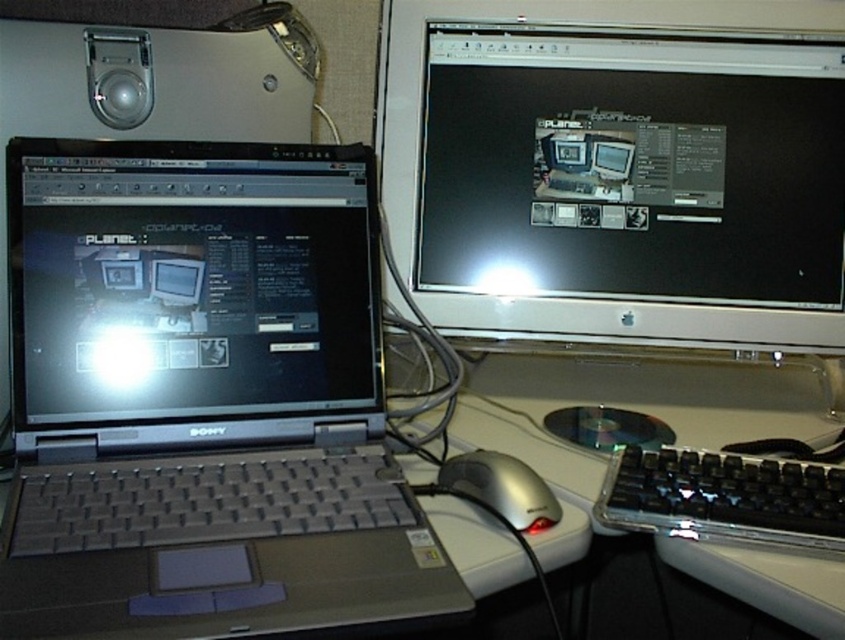
Who is higher up, satin silver monitor at upper center or white plastic computer desk at center?

Positioned higher is satin silver monitor at upper center.

How much distance is there between satin silver monitor at upper center and white plastic computer desk at center?

satin silver monitor at upper center is 9.40 inches from white plastic computer desk at center.

You are a GUI agent. You are given a task and a screenshot of the screen. Output one action in this format:
    pyautogui.click(x=<x>, y=<y>)
    Task: Click on the satin silver monitor at upper center
    The width and height of the screenshot is (845, 640).
    Given the screenshot: What is the action you would take?
    pyautogui.click(x=619, y=168)

The height and width of the screenshot is (640, 845). Identify the location of satin silver monitor at upper center. (619, 168).

Can you confirm if satin silver monitor at upper center is positioned above clear plastic keyboard at lower right?

Yes, satin silver monitor at upper center is above clear plastic keyboard at lower right.

Between satin silver monitor at upper center and clear plastic keyboard at lower right, which one appears on the right side from the viewer's perspective?

Positioned to the right is clear plastic keyboard at lower right.

Between point (625, 120) and point (818, 496), which one is positioned behind?

Point (625, 120)

You are a GUI agent. You are given a task and a screenshot of the screen. Output one action in this format:
    pyautogui.click(x=<x>, y=<y>)
    Task: Click on the satin silver monitor at upper center
    The height and width of the screenshot is (640, 845).
    Given the screenshot: What is the action you would take?
    pyautogui.click(x=619, y=168)

Measure the distance between point (805, 536) and camera.

They are 25.18 inches apart.

Which is more to the left, clear plastic keyboard at lower right or silver metallic mouse at center?

Positioned to the left is silver metallic mouse at center.

This screenshot has width=845, height=640. Describe the element at coordinates (724, 497) in the screenshot. I see `clear plastic keyboard at lower right` at that location.

At what (x,y) coordinates should I click in order to perform the action: click on clear plastic keyboard at lower right. Please return your answer as a coordinate pair (x, y). Image resolution: width=845 pixels, height=640 pixels. Looking at the image, I should click on (724, 497).